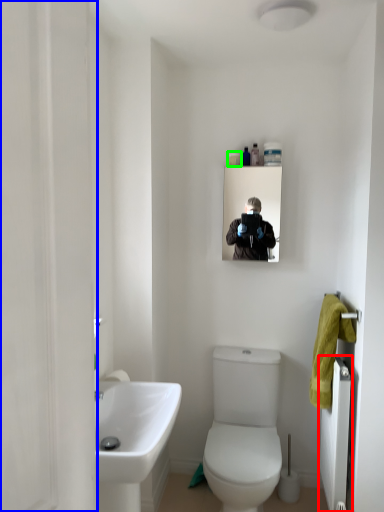
Question: Estimate the real-world distances between objects in this image. Which object is closer to radiator (highlighted by a red box), screen door (highlighted by a blue box) or toiletry (highlighted by a green box)?

Choices:
 (A) screen door
 (B) toiletry

Answer: (B)